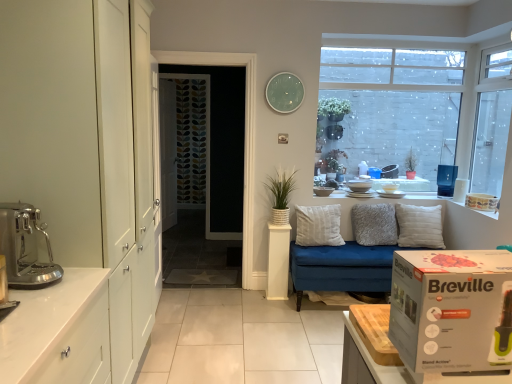
What do you see at coordinates (284, 92) in the screenshot? This screenshot has width=512, height=384. I see `green glass clock at upper center` at bounding box center [284, 92].

The width and height of the screenshot is (512, 384). Describe the element at coordinates (452, 309) in the screenshot. I see `white cardboard box at right` at that location.

Find the location of `white painted wood door at center, positioned as the 2th door in right-to-left order`. white painted wood door at center, positioned as the 2th door in right-to-left order is located at coordinates (168, 152).

At what (x,y) coordinates should I click in order to perform the action: click on white glossy cup at upper center, the 4th appliance when ordered from front to back. Please return your answer as a coordinate pair (x, y). This screenshot has width=512, height=384. Looking at the image, I should click on (390, 188).

At what (x,y) coordinates should I click in order to perform the action: click on green glass clock at upper center. Please return your answer as a coordinate pair (x, y). Image resolution: width=512 pixels, height=384 pixels. Looking at the image, I should click on (284, 92).

Can you confirm if white soft cushion at center, positioned as the 1th pillow in left-to-right order, is bigger than white ceramic bowl at upper right, which appears as the second appliance when viewed from the front?

Indeed, white soft cushion at center, positioned as the 1th pillow in left-to-right order, has a larger size compared to white ceramic bowl at upper right, which appears as the second appliance when viewed from the front.

Which object is further away from the camera, white soft cushion at center, the 3th pillow from the right, or white ceramic bowl at upper right, placed as the first appliance when sorted from top to bottom?

white ceramic bowl at upper right, placed as the first appliance when sorted from top to bottom, is further from the camera.

Who is taller, white soft cushion at center, positioned as the 1th pillow in left-to-right order, or white ceramic bowl at upper right, which appears as the second appliance when viewed from the front?

white soft cushion at center, positioned as the 1th pillow in left-to-right order.

Which is more distant, (312, 209) or (367, 181)?

The point (367, 181) is farther.

Considering the relative sizes of transparent glass screen door at center and green glass clock at upper center in the image provided, is transparent glass screen door at center smaller than green glass clock at upper center?

Actually, transparent glass screen door at center might be larger than green glass clock at upper center.

Measure the distance between transparent glass screen door at center and green glass clock at upper center.

A distance of 17.28 inches exists between transparent glass screen door at center and green glass clock at upper center.

Considering the positions of objects transparent glass screen door at center and green glass clock at upper center in the image provided, who is in front, transparent glass screen door at center or green glass clock at upper center?

Positioned in front is transparent glass screen door at center.

Are transparent glass screen door at center and green glass clock at upper center far apart?

transparent glass screen door at center is near green glass clock at upper center, not far away.

Does white ceramic bowl at upper right, which appears as the second appliance when viewed from the front, lie in front of white glossy cup at upper center, which appears as the third appliance when ordered from the bottom?

Yes, white ceramic bowl at upper right, which appears as the second appliance when viewed from the front, is closer to the viewer.

Considering the sizes of objects white ceramic bowl at upper right, the fourth appliance when ordered from bottom to top, and white glossy cup at upper center, placed as the 2th appliance when sorted from top to bottom, in the image provided, who is thinner, white ceramic bowl at upper right, the fourth appliance when ordered from bottom to top, or white glossy cup at upper center, placed as the 2th appliance when sorted from top to bottom,?

Thinner between the two is white glossy cup at upper center, placed as the 2th appliance when sorted from top to bottom.

Which object is positioned more to the right, white ceramic bowl at upper right, which ranks as the 2th appliance in right-to-left order, or white glossy cup at upper center, which is the first appliance from back to front?

white glossy cup at upper center, which is the first appliance from back to front, is more to the right.

Is patterned fabric door at center, the second door viewed from the left, aimed at matte ceramic mug at upper center, marked as the second appliance in a back-to-front arrangement?

No, patterned fabric door at center, the second door viewed from the left, is not aimed at matte ceramic mug at upper center, marked as the second appliance in a back-to-front arrangement.

Which is closer to the camera, (x=179, y=75) or (x=315, y=191)?

The point (x=315, y=191) is in front.

From the image's perspective, who appears lower, patterned fabric door at center, the first door in the right-to-left sequence, or matte ceramic mug at upper center, which appears as the third appliance when viewed from the right?

From the image's view, matte ceramic mug at upper center, which appears as the third appliance when viewed from the right, is below.

Considering the positions of point (7, 298) and point (247, 175), is point (7, 298) closer or farther from the camera than point (247, 175)?

Clearly, point (7, 298) is closer to the camera than point (247, 175).

Between metallic stainless steel coffee machine at left, the fourth appliance from the top, and transparent glass screen door at center, which one appears on the right side from the viewer's perspective?

Positioned to the right is transparent glass screen door at center.

Is metallic stainless steel coffee machine at left, which is counted as the 1th appliance, starting from the left, oriented away from transparent glass screen door at center?

No, metallic stainless steel coffee machine at left, which is counted as the 1th appliance, starting from the left, is not facing away from transparent glass screen door at center.

Is white textured pot at center looking in the opposite direction of matte ceramic mug at upper center, the 3th appliance when ordered from front to back?

white textured pot at center is not turned away from matte ceramic mug at upper center, the 3th appliance when ordered from front to back.

How distant is white textured pot at center from matte ceramic mug at upper center, acting as the 3th appliance starting from the top?

They are 12.63 inches apart.

Considering the relative positions of white textured pot at center and matte ceramic mug at upper center, which appears as the second appliance when viewed from the left, in the image provided, is white textured pot at center in front of matte ceramic mug at upper center, which appears as the second appliance when viewed from the left,?

Yes, white textured pot at center is closer to the camera.

Is point (284, 199) farther from viewer compared to point (330, 188)?

That is False.

Can you tell me how much white ceramic bowl at upper right, the third appliance in the left-to-right sequence, and transparent glass window at upper right, placed as the second window when sorted from left to right, differ in facing direction?

The facing directions of white ceramic bowl at upper right, the third appliance in the left-to-right sequence, and transparent glass window at upper right, placed as the second window when sorted from left to right, are 92.6 degrees apart.

Is white ceramic bowl at upper right, the third appliance in the left-to-right sequence, behind transparent glass window at upper right, placed as the second window when sorted from left to right?

Yes, it is.

Which object is positioned more to the right, white ceramic bowl at upper right, the third appliance in the left-to-right sequence, or transparent glass window at upper right, the 1th window in the right-to-left sequence?

transparent glass window at upper right, the 1th window in the right-to-left sequence, is more to the right.

Based on the photo, is white ceramic bowl at upper right, which appears as the second appliance when viewed from the front, wider than transparent glass window at upper right, placed as the second window when sorted from left to right?

Indeed, white ceramic bowl at upper right, which appears as the second appliance when viewed from the front, has a greater width compared to transparent glass window at upper right, placed as the second window when sorted from left to right.

Where is `the 2nd appliance to the right of the white soft cushion at center, the 3th pillow from the right, starting your count from the anchor`? This screenshot has height=384, width=512. the 2nd appliance to the right of the white soft cushion at center, the 3th pillow from the right, starting your count from the anchor is located at coordinates (359, 185).

In the image, there is a green glass clock at upper center. Where is `screen door below it (from a real-world perspective)`? screen door below it (from a real-world perspective) is located at coordinates (244, 135).

Which object lies nearer to the anchor point grey fluffy pillow at center, the second pillow viewed from the left, white glossy cabinet at left or white glossy cup at upper center, the 4th appliance when ordered from left to right?

white glossy cup at upper center, the 4th appliance when ordered from left to right, lies closer to grey fluffy pillow at center, the second pillow viewed from the left, than the other object.

When comparing their distances from white textured pillow at center, positioned as the 3th pillow in left-to-right order, does metallic stainless steel coffee machine at left, acting as the first appliance starting from the bottom, or white glossy cabinet at lower left seem further?

metallic stainless steel coffee machine at left, acting as the first appliance starting from the bottom, is positioned further to the anchor white textured pillow at center, positioned as the 3th pillow in left-to-right order.

From the image, which object appears to be nearer to transparent glass screen door at center, green glass clock at upper center or white ceramic bowl at upper right, which appears as the second appliance when viewed from the front?

green glass clock at upper center.

Which object lies nearer to the anchor point transparent glass window at upper right, arranged as the 1th window when viewed from the left, matte ceramic mug at upper center, marked as the second appliance in a back-to-front arrangement, or white ceramic bowl at upper right, which appears as the second appliance when viewed from the front?

white ceramic bowl at upper right, which appears as the second appliance when viewed from the front, is positioned closer to the anchor transparent glass window at upper right, arranged as the 1th window when viewed from the left.

Based on their spatial positions, is white painted wood door at center, which is counted as the first door, starting from the left, or white ceramic bowl at upper right, placed as the first appliance when sorted from top to bottom, closer to white glossy cabinet at left?

The object closer to white glossy cabinet at left is white ceramic bowl at upper right, placed as the first appliance when sorted from top to bottom.

In the scene shown: Considering their positions, is transparent glass window at upper right, the 1th window in the right-to-left sequence, positioned further to white ceramic bowl at upper right, the third appliance in the left-to-right sequence, than patterned fabric door at center, the second door viewed from the left?

patterned fabric door at center, the second door viewed from the left, is positioned further to the anchor white ceramic bowl at upper right, the third appliance in the left-to-right sequence.

Estimate the real-world distances between objects in this image. Which object is closer to patterned fabric door at center, the first door in the right-to-left sequence, transparent glass window at upper right, arranged as the 1th window when viewed from the left, or matte ceramic mug at upper center, which appears as the second appliance when viewed from the left?

Based on the image, transparent glass window at upper right, arranged as the 1th window when viewed from the left, appears to be nearer to patterned fabric door at center, the first door in the right-to-left sequence.

From the picture: When comparing their distances from green glass clock at upper center, does white cardboard box at right or grey fluffy pillow at center, the second pillow viewed from the left, seem further?

Based on the image, white cardboard box at right appears to be further to green glass clock at upper center.

The image size is (512, 384). I want to click on dresser positioned between white glossy cabinet at lower left and transparent glass screen door at center from near to far, so click(82, 176).

Image resolution: width=512 pixels, height=384 pixels. In order to click on screen door between patterned fabric door at center, the first door in the right-to-left sequence, and transparent glass window at upper right, arranged as the 1th window when viewed from the left in this screenshot , I will do `click(244, 135)`.

Image resolution: width=512 pixels, height=384 pixels. I want to click on pillow between white glossy cabinet at lower left and white textured pillow at center, positioned as the 3th pillow in left-to-right order, from front to back, so click(x=318, y=225).

Locate an element on the screen. The image size is (512, 384). dresser positioned between white glossy cabinet at lower left and transparent glass window at upper right, arranged as the 1th window when viewed from the left, from near to far is located at coordinates (82, 176).